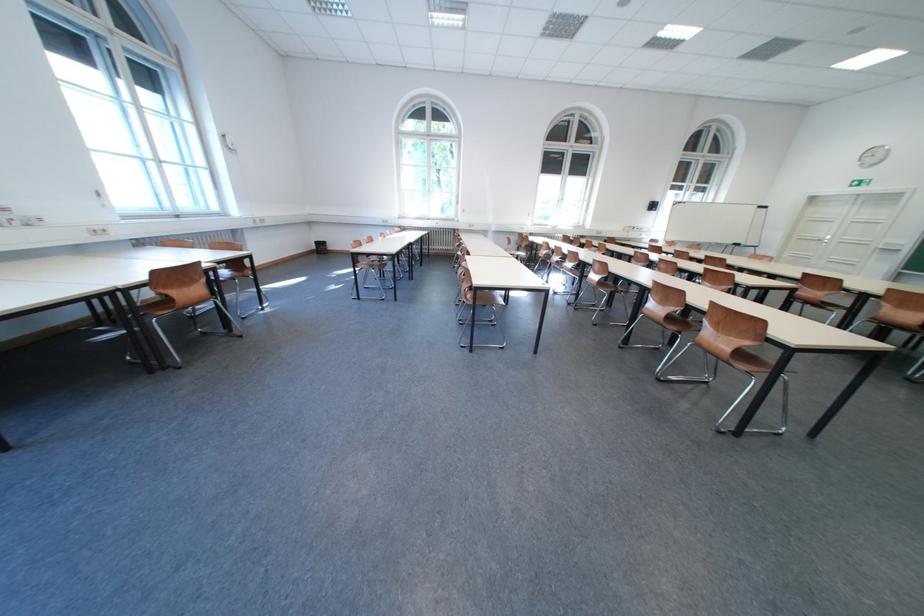
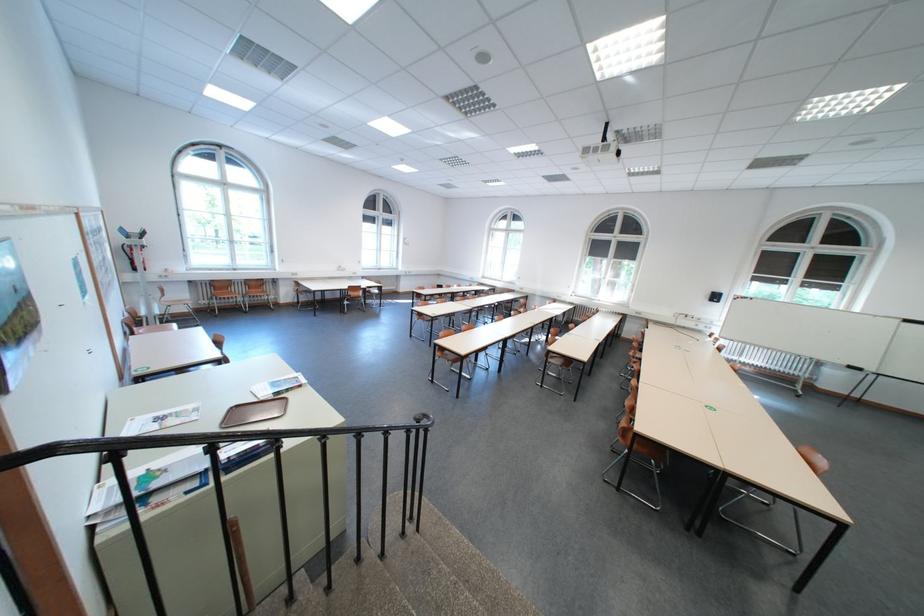
Question: I am providing you with two images of the same scene from different viewpoints. After the viewpoint changes to image2, which objects are now occluded?

Choices:
 (A) brown chair sitting surface
 (B) white paper brochure
 (C) fire extinguisher handle
 (D) metal dispenser

Answer: (A)